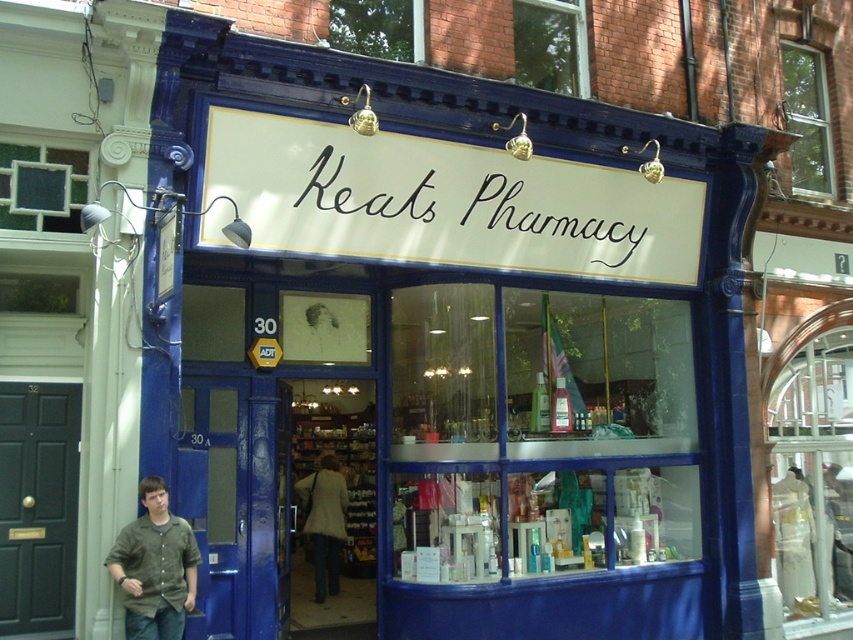
Question: Does white painted wood sign at center lie in front of green cotton shirt at lower left?

Choices:
 (A) no
 (B) yes

Answer: (A)

Question: Can you confirm if white painted wood sign at center is positioned above green cotton shirt at lower left?

Choices:
 (A) no
 (B) yes

Answer: (B)

Question: Which point is closer to the camera?

Choices:
 (A) white painted wood sign at center
 (B) green cotton shirt at lower left

Answer: (B)

Question: Does white painted wood sign at center appear over green cotton shirt at lower left?

Choices:
 (A) no
 (B) yes

Answer: (B)

Question: Which of the following is the closest to the observer?

Choices:
 (A) white painted wood sign at center
 (B) green cotton shirt at lower left

Answer: (B)